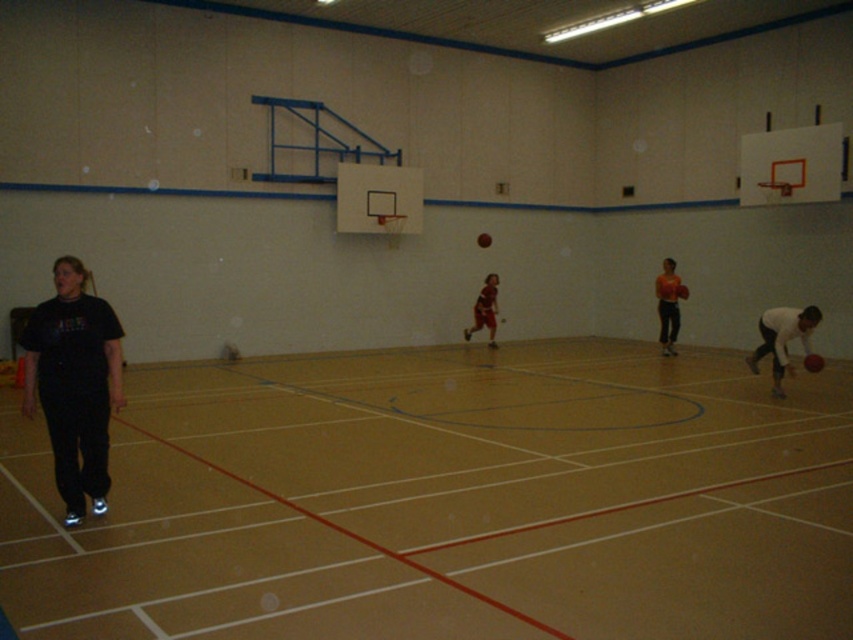
You are a photographer positioned at the back of the court. You want to capture a photo of the matte brown shorts at center and the rubber basketball at center. Which object should you zoom in on to ensure both are in focus without moving your position?

Since the matte brown shorts at center is larger in size than the rubber basketball at center, you should zoom in on the matte brown shorts at center to ensure both are in focus without moving your position.

You are a spectator at the basketball court and want to know which object is taller between the matte brown shorts at center and the rubber basketball at center. Can you tell me?

The matte brown shorts at center has a greater height compared to the rubber basketball at center, so the matte brown shorts at center is taller.